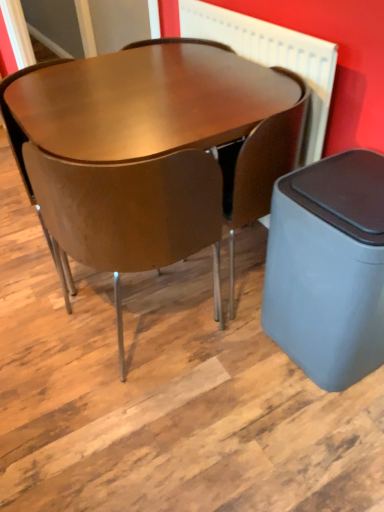
Question: In the image, is matte brown chair at center, which ranks as the 1th chair in right-to-left order, positioned in front of or behind glossy wood table at center?

Choices:
 (A) front
 (B) behind

Answer: (B)

Question: In terms of size, does matte brown chair at center, the second chair when ordered from left to right, appear bigger or smaller than glossy wood table at center?

Choices:
 (A) big
 (B) small

Answer: (B)

Question: Considering the real-world distances, which object is closest to the white textured radiator at upper center?

Choices:
 (A) glossy wood table at center
 (B) matte brown chair at center, which ranks as the 1th chair in right-to-left order
 (C) gray matte waste bin at lower right
 (D) matte brown chair at center, the second chair positioned from the right

Answer: (B)

Question: Estimate the real-world distances between objects in this image. Which object is closer to the matte brown chair at center, the second chair when ordered from left to right?

Choices:
 (A) matte brown chair at center, the second chair positioned from the right
 (B) white textured radiator at upper center
 (C) glossy wood table at center
 (D) gray matte waste bin at lower right

Answer: (B)